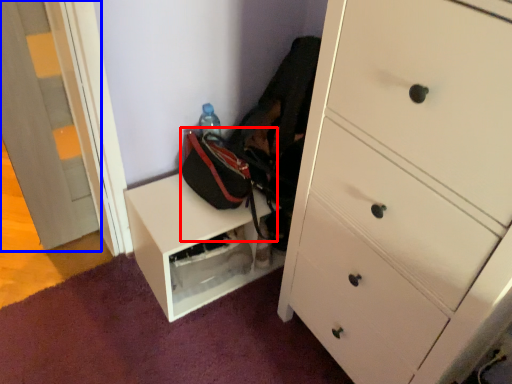
Question: Which object is closer to the camera taking this photo, messenger bag (highlighted by a red box) or door (highlighted by a blue box)?

Choices:
 (A) messenger bag
 (B) door

Answer: (B)